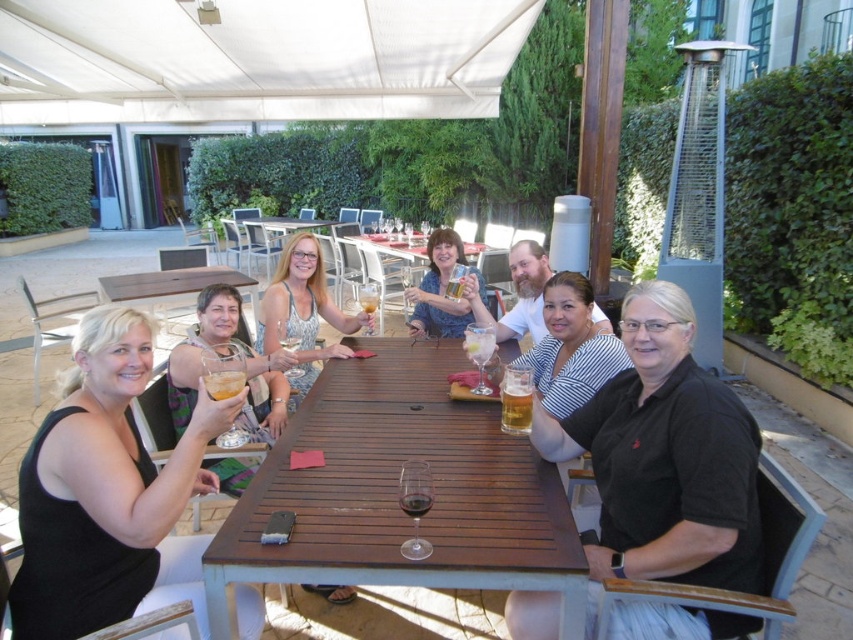
Question: Which object appears closest to the camera in this image?

Choices:
 (A) translucent glass beer at center
 (B) wooden table at center
 (C) matte plastic cup at center
 (D) black matte tank top at left

Answer: (D)

Question: Which point is closer to the camera?

Choices:
 (A) clear glass wine at center
 (B) wooden table at center
 (C) dark glass wine at center

Answer: (C)

Question: Which point is closer to the camera?

Choices:
 (A) (463, 333)
 (B) (276, 296)

Answer: (A)

Question: Considering the relative positions of matte white dress at center and matte plastic cup at center in the image provided, where is matte white dress at center located with respect to matte plastic cup at center?

Choices:
 (A) left
 (B) right

Answer: (A)

Question: Is matte plastic cup at center to the right of translucent glass beer at center from the viewer's perspective?

Choices:
 (A) no
 (B) yes

Answer: (A)

Question: Can you confirm if matte white dress at center is bigger than clear glass wine at center?

Choices:
 (A) yes
 (B) no

Answer: (A)